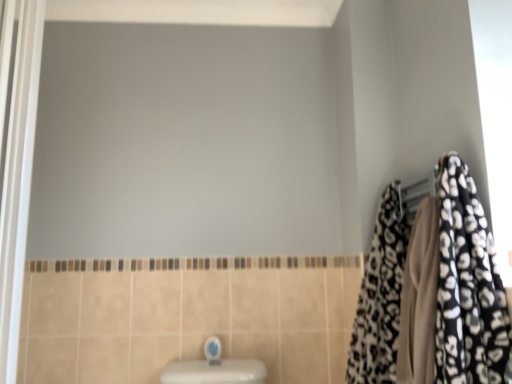
What do you see at coordinates (380, 296) in the screenshot?
I see `leopard print towel at right` at bounding box center [380, 296].

In order to click on white glossy screen door at left in this screenshot , I will do `click(18, 179)`.

The width and height of the screenshot is (512, 384). What do you see at coordinates (467, 286) in the screenshot?
I see `leopard print fabric at right` at bounding box center [467, 286].

The height and width of the screenshot is (384, 512). What do you see at coordinates (213, 350) in the screenshot?
I see `blue glossy faucet at lower center` at bounding box center [213, 350].

Where is `leopard print towel at right`? The height and width of the screenshot is (384, 512). leopard print towel at right is located at coordinates (380, 296).

Which object is wider, white glossy screen door at left or leopard print towel at right?

leopard print towel at right.

From the image's perspective, would you say white glossy screen door at left is shown under leopard print towel at right?

No, from the image's perspective, white glossy screen door at left is not below leopard print towel at right.

In order to click on cloth behind the white glossy screen door at left in this screenshot , I will do [380, 296].

Is white glossy screen door at left closer to the viewer compared to leopard print towel at right?

Yes, the depth of white glossy screen door at left is less than that of leopard print towel at right.

Who is more distant, leopard print towel at right or blue glossy faucet at lower center?

Positioned behind is blue glossy faucet at lower center.

How many degrees apart are the facing directions of leopard print towel at right and blue glossy faucet at lower center?

There is a 95-degree angle between the facing directions of leopard print towel at right and blue glossy faucet at lower center.

Is leopard print towel at right beside blue glossy faucet at lower center?

They are not placed beside each other.

From the image's perspective, does leopard print towel at right appear lower than blue glossy faucet at lower center?

No, from the image's perspective, leopard print towel at right is not below blue glossy faucet at lower center.

Considering the positions of objects blue glossy faucet at lower center and leopard print fabric at right in the image provided, who is in front, blue glossy faucet at lower center or leopard print fabric at right?

leopard print fabric at right is in front.

Considering the relative sizes of blue glossy faucet at lower center and leopard print fabric at right in the image provided, is blue glossy faucet at lower center wider than leopard print fabric at right?

No, blue glossy faucet at lower center is not wider than leopard print fabric at right.

What's the angular difference between blue glossy faucet at lower center and leopard print fabric at right's facing directions?

blue glossy faucet at lower center and leopard print fabric at right are facing 92.3 degrees away from each other.

Considering the positions of points (206, 351) and (366, 293), is point (206, 351) closer to camera compared to point (366, 293)?

No, (206, 351) is behind (366, 293).

Considering the relative positions of leopard print towel at right and white glossy screen door at left in the image provided, is leopard print towel at right to the right of white glossy screen door at left from the viewer's perspective?

Yes.

Considering the sizes of leopard print towel at right and white glossy screen door at left in the image, is leopard print towel at right wider or thinner than white glossy screen door at left?

Considering their sizes, leopard print towel at right looks broader than white glossy screen door at left.

Does point (371, 299) come closer to viewer compared to point (3, 335)?

No, it is behind (3, 335).

Looking at their sizes, would you say leopard print towel at right is wider or thinner than leopard print fabric at right?

In the image, leopard print towel at right appears to be wider than leopard print fabric at right.

How different are the orientations of leopard print towel at right and leopard print fabric at right in degrees?

The facing directions of leopard print towel at right and leopard print fabric at right are 2.75 degrees apart.

Is leopard print towel at right placed right next to leopard print fabric at right?

Yes, leopard print towel at right is right next to leopard print fabric at right and making contact.

Which is more to the left, leopard print towel at right or leopard print fabric at right?

Positioned to the left is leopard print towel at right.

Between white glossy screen door at left and leopard print fabric at right, which one is positioned behind?

white glossy screen door at left is more distant.

Where is `closet that appears below the white glossy screen door at left (from the image's perspective)`? closet that appears below the white glossy screen door at left (from the image's perspective) is located at coordinates (467, 286).

From the image's perspective, is white glossy screen door at left under leopard print fabric at right?

No.

From a real-world perspective, is white glossy screen door at left physically below leopard print fabric at right?

No, from a real-world perspective, white glossy screen door at left is not below leopard print fabric at right.

Does white glossy screen door at left turn towards blue glossy faucet at lower center?

No.

Is white glossy screen door at left wider or thinner than blue glossy faucet at lower center?

Considering their sizes, white glossy screen door at left looks slimmer than blue glossy faucet at lower center.

Between white glossy screen door at left and blue glossy faucet at lower center, which one has less height?

blue glossy faucet at lower center is shorter.

In the scene shown: Considering the positions of objects white glossy screen door at left and blue glossy faucet at lower center in the image provided, who is more to the left, white glossy screen door at left or blue glossy faucet at lower center?

white glossy screen door at left is more to the left.

What are the coordinates of `screen door that is on the left side of leopard print towel at right` in the screenshot? It's located at (18, 179).

Where is `cloth above the blue glossy faucet at lower center (from the image's perspective)`? The height and width of the screenshot is (384, 512). cloth above the blue glossy faucet at lower center (from the image's perspective) is located at coordinates (380, 296).

Based on their spatial positions, is leopard print towel at right or white glossy screen door at left further from blue glossy faucet at lower center?

white glossy screen door at left.

From the image, which object appears to be nearer to white glossy screen door at left, leopard print towel at right or blue glossy faucet at lower center?

blue glossy faucet at lower center is positioned closer to the anchor white glossy screen door at left.

Estimate the real-world distances between objects in this image. Which object is closer to blue glossy faucet at lower center, leopard print fabric at right or white glossy screen door at left?

Among the two, leopard print fabric at right is located nearer to blue glossy faucet at lower center.

When comparing their distances from leopard print towel at right, does blue glossy faucet at lower center or leopard print fabric at right seem closer?

Based on the image, leopard print fabric at right appears to be nearer to leopard print towel at right.

Based on the photo, estimate the real-world distances between objects in this image. Which object is further from blue glossy faucet at lower center, white glossy screen door at left or leopard print towel at right?

white glossy screen door at left is positioned further to the anchor blue glossy faucet at lower center.

Consider the image. Considering their positions, is leopard print towel at right positioned closer to blue glossy faucet at lower center than leopard print fabric at right?

leopard print fabric at right.

Which object lies nearer to the anchor point leopard print fabric at right, blue glossy faucet at lower center or leopard print towel at right?

Based on the image, leopard print towel at right appears to be nearer to leopard print fabric at right.

Considering their positions, is blue glossy faucet at lower center positioned further to white glossy screen door at left than leopard print towel at right?

Among the two, leopard print towel at right is located further to white glossy screen door at left.

What are the coordinates of `cloth located between white glossy screen door at left and leopard print fabric at right in the left-right direction` in the screenshot? It's located at (380, 296).

I want to click on faucet between white glossy screen door at left and leopard print towel at right from left to right, so click(x=213, y=350).

The height and width of the screenshot is (384, 512). Find the location of `cloth between leopard print fabric at right and blue glossy faucet at lower center along the z-axis`. cloth between leopard print fabric at right and blue glossy faucet at lower center along the z-axis is located at coordinates (380, 296).

The height and width of the screenshot is (384, 512). Find the location of `faucet between white glossy screen door at left and leopard print fabric at right in the horizontal direction`. faucet between white glossy screen door at left and leopard print fabric at right in the horizontal direction is located at coordinates (213, 350).